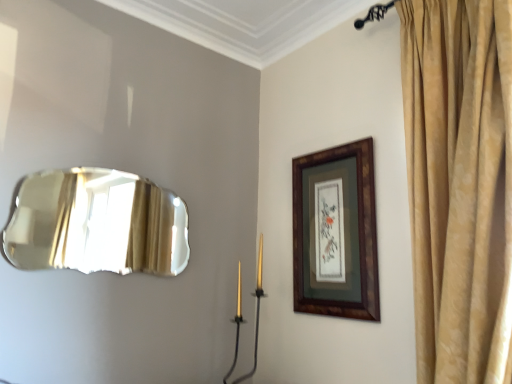
Question: From a real-world perspective, is gold metallic candle holder at center on top of shiny metallic mirror at left?

Choices:
 (A) no
 (B) yes

Answer: (A)

Question: From the image's perspective, is gold metallic candle holder at center on shiny metallic mirror at left?

Choices:
 (A) yes
 (B) no

Answer: (B)

Question: From the image's perspective, would you say gold metallic candle holder at center is shown under shiny metallic mirror at left?

Choices:
 (A) no
 (B) yes

Answer: (B)

Question: Can we say gold metallic candle holder at center lies outside shiny metallic mirror at left?

Choices:
 (A) no
 (B) yes

Answer: (B)

Question: Does gold metallic candle holder at center appear on the right side of shiny metallic mirror at left?

Choices:
 (A) no
 (B) yes

Answer: (B)

Question: In the image, is wooden frame at upper right positioned in front of or behind shiny metallic mirror at left?

Choices:
 (A) behind
 (B) front

Answer: (A)

Question: From a real-world perspective, is wooden frame at upper right above or below shiny metallic mirror at left?

Choices:
 (A) above
 (B) below

Answer: (B)

Question: Is wooden frame at upper right wider or thinner than shiny metallic mirror at left?

Choices:
 (A) wide
 (B) thin

Answer: (B)

Question: From the image's perspective, is wooden frame at upper right located above or below shiny metallic mirror at left?

Choices:
 (A) above
 (B) below

Answer: (B)

Question: Is shiny metallic mirror at left wider or thinner than wooden frame at upper right?

Choices:
 (A) thin
 (B) wide

Answer: (B)

Question: From the image's perspective, is shiny metallic mirror at left positioned above or below wooden frame at upper right?

Choices:
 (A) above
 (B) below

Answer: (A)

Question: Is shiny metallic mirror at left bigger or smaller than wooden frame at upper right?

Choices:
 (A) small
 (B) big

Answer: (B)

Question: Would you say shiny metallic mirror at left is to the left or to the right of wooden frame at upper right in the picture?

Choices:
 (A) right
 (B) left

Answer: (B)

Question: Relative to gold velvet curtain at upper right, is gold metallic candle holder at center in front or behind?

Choices:
 (A) front
 (B) behind

Answer: (B)

Question: Is gold metallic candle holder at center spatially inside gold velvet curtain at upper right, or outside of it?

Choices:
 (A) outside
 (B) inside

Answer: (A)